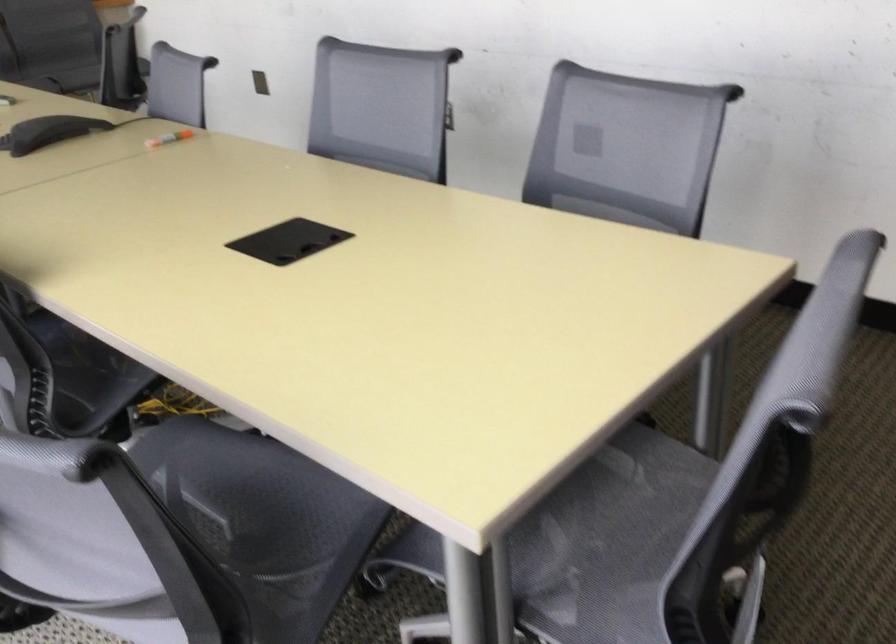
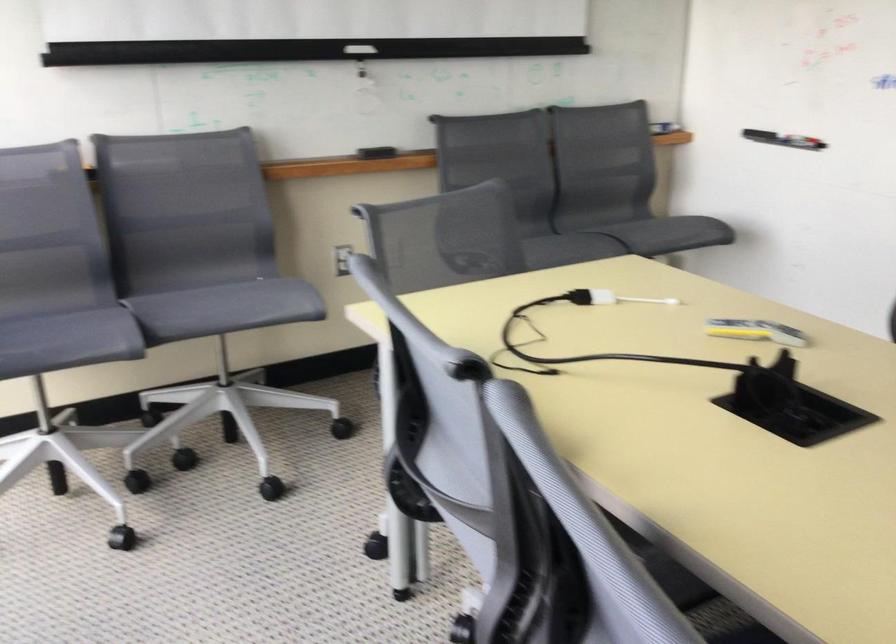
What movement of the cameraman would produce the second image?

The cameraman walked toward left, forward.